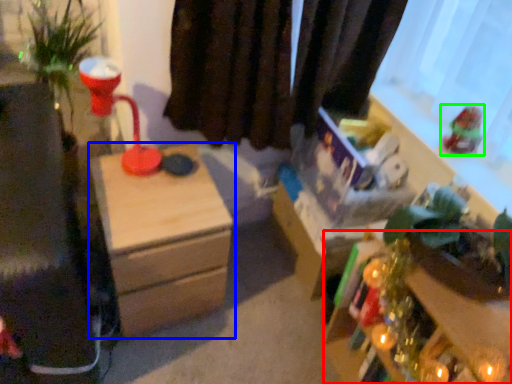
Question: Which object is positioned farthest from table (highlighted by a red box)? Select from nightstand (highlighted by a blue box) and toy (highlighted by a green box).

Choices:
 (A) nightstand
 (B) toy

Answer: (A)